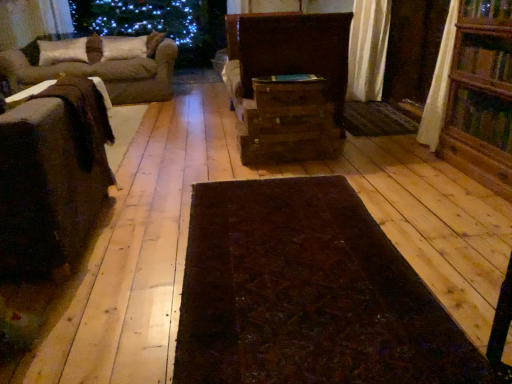
Question: Is wooden bookshelf at right bigger or smaller than wooden drawer at center, placed as the 2th drawer when sorted from top to bottom?

Choices:
 (A) big
 (B) small

Answer: (A)

Question: From a real-world perspective, is wooden bookshelf at right physically located above or below wooden drawer at center, which ranks as the second drawer in bottom-to-top order?

Choices:
 (A) above
 (B) below

Answer: (A)

Question: Which of these objects is positioned closest to the suede-like beige pillow at upper left, which is the second pillow in left-to-right order?

Choices:
 (A) wooden bookshelf at right
 (B) brown fabric couch at left
 (C) wooden chest at center, placed as the first drawer when sorted from top to bottom
 (D) suede-like beige pillow at upper left, the 1th pillow viewed from the left
 (E) brown wooden drawer at center, the first drawer positioned from the bottom

Answer: (B)

Question: Estimate the real-world distances between objects in this image. Which object is farther from the brown fabric couch at left?

Choices:
 (A) suede-like beige pillow at upper left, the 1th pillow positioned from the right
 (B) dark brown fabric couch at left, the 1th furniture positioned from the front
 (C) brown wooden drawer at center, which is counted as the 3th drawer, starting from the top
 (D) suede-like beige pillow at upper left, the second pillow when ordered from right to left
 (E) wooden drawer at center, placed as the 2th drawer when sorted from top to bottom

Answer: (E)